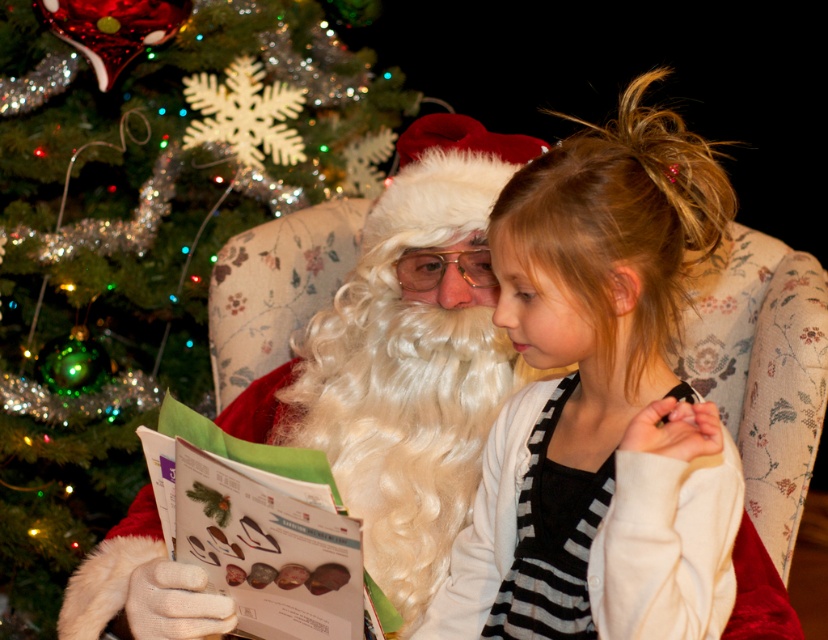
Question: Which object appears closest to the camera in this image?

Choices:
 (A) white cardigan at center
 (B) green glittery christmas tree at left

Answer: (A)

Question: Does green glittery christmas tree at left appear over white cardigan at center?

Choices:
 (A) yes
 (B) no

Answer: (A)

Question: Can you confirm if green glittery christmas tree at left is positioned to the left of white cardigan at center?

Choices:
 (A) yes
 (B) no

Answer: (A)

Question: Which of the following is the farthest from the observer?

Choices:
 (A) white cardigan at center
 (B) green glittery christmas tree at left

Answer: (B)

Question: Is green glittery christmas tree at left smaller than white cardigan at center?

Choices:
 (A) no
 (B) yes

Answer: (A)